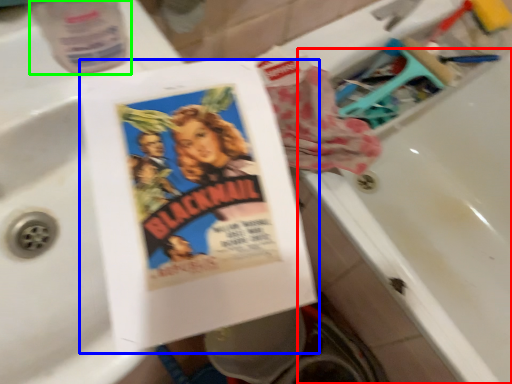
Question: Which object is the closest to the bath (highlighted by a red box)? Choose among these: paperback book (highlighted by a blue box) or bottle (highlighted by a green box).

Choices:
 (A) paperback book
 (B) bottle

Answer: (A)